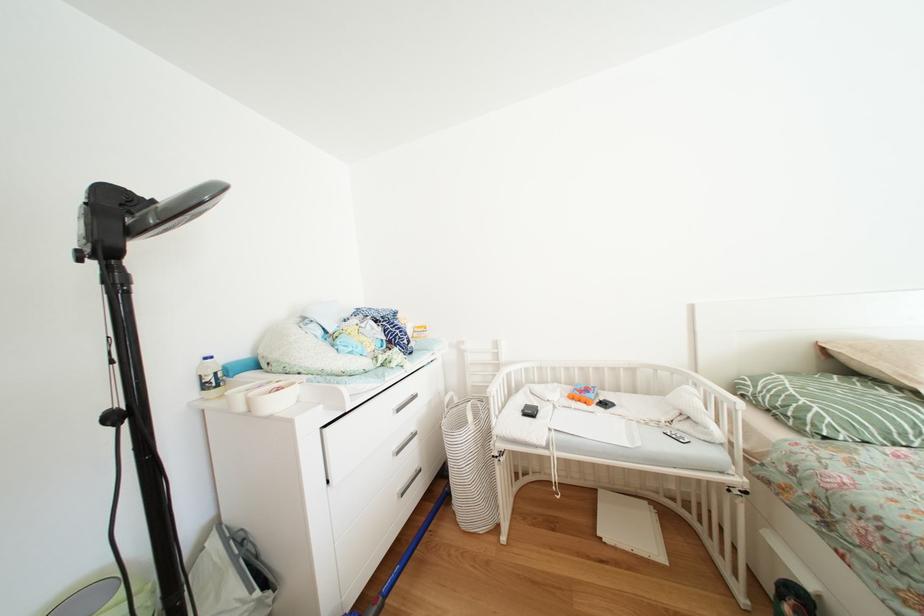
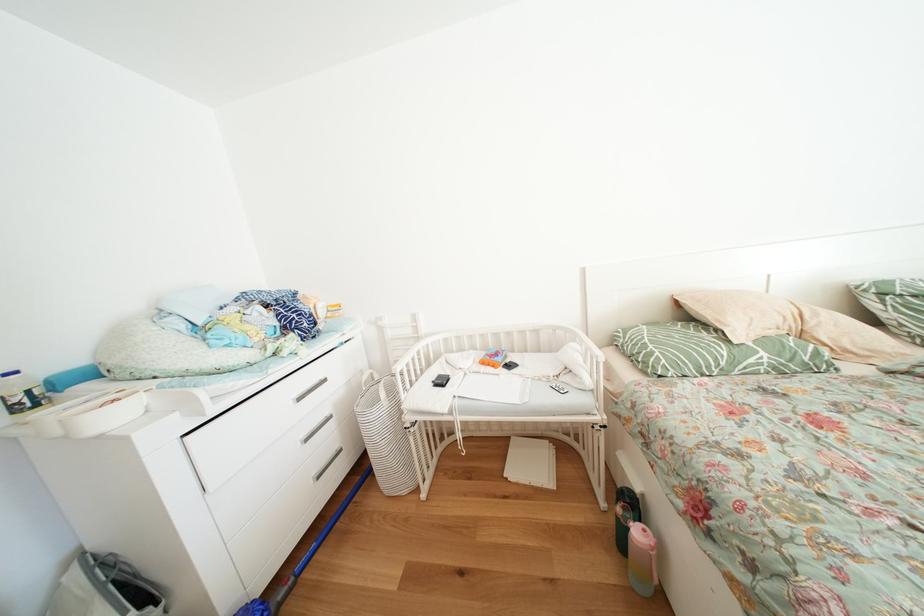
In the second image, find the point that corresponds to the point at 578,394 in the first image.

(491, 360)